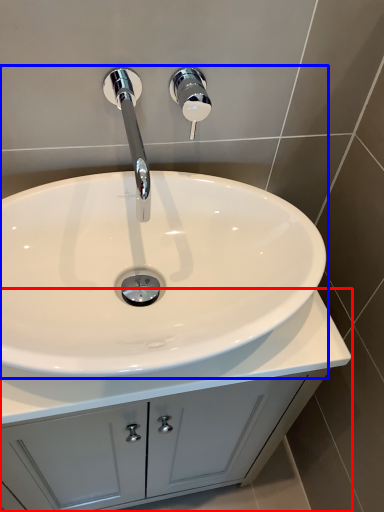
Question: Which of the following is the farthest to the observer, bathroom cabinet (highlighted by a red box) or sink (highlighted by a blue box)?

Choices:
 (A) bathroom cabinet
 (B) sink

Answer: (A)